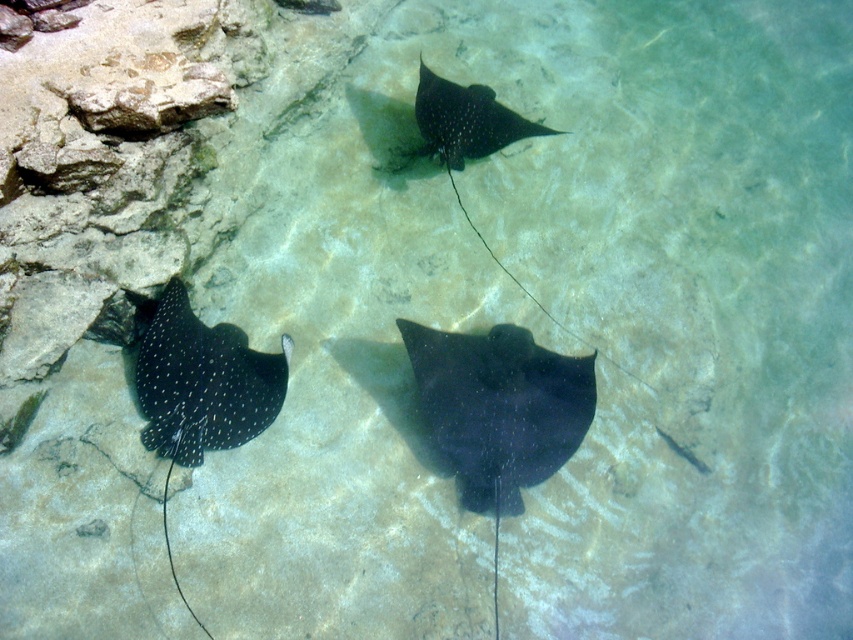
You are a marine biologist observing the underwater scene. You notice the black glossy stingray at center and the black dotted stingray at lower left. Which stingray is positioned lower in the water?

The black glossy stingray at center is located below the black dotted stingray at lower left, so it is positioned lower in the water.